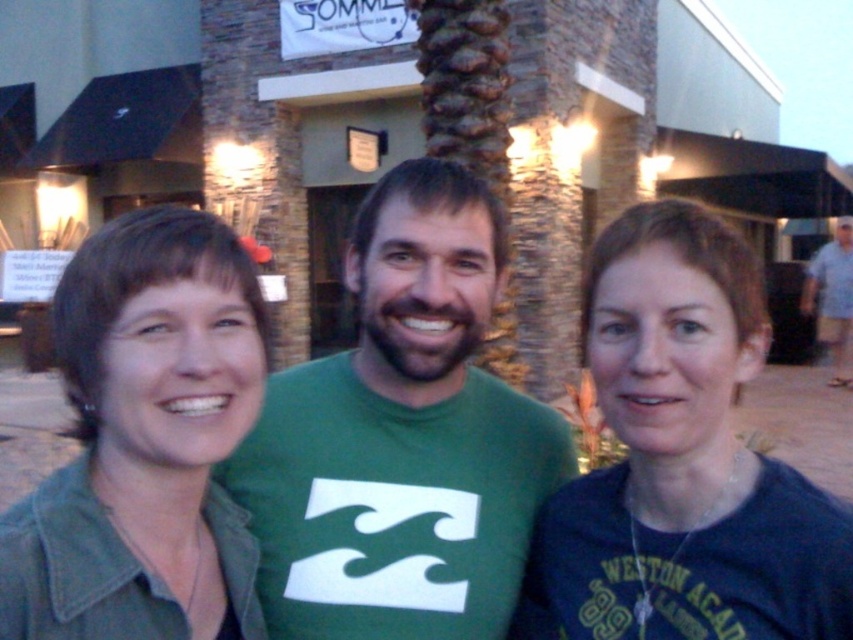
Question: Is denim jacket at left bigger than light blue shirt at right?

Choices:
 (A) no
 (B) yes

Answer: (B)

Question: Among these objects, which one is farthest from the camera?

Choices:
 (A) light blue shirt at right
 (B) green matte t-shirt at center
 (C) dark blue t-shirt at center
 (D) denim jacket at left

Answer: (A)

Question: Does green matte t-shirt at center have a smaller size compared to denim jacket at left?

Choices:
 (A) yes
 (B) no

Answer: (B)

Question: Which object is the farthest from the green matte t-shirt at center?

Choices:
 (A) light blue shirt at right
 (B) dark blue t-shirt at center
 (C) denim jacket at left

Answer: (A)

Question: Which object is the farthest from the denim jacket at left?

Choices:
 (A) light blue shirt at right
 (B) green matte t-shirt at center

Answer: (A)

Question: Is green matte t-shirt at center above light blue shirt at right?

Choices:
 (A) no
 (B) yes

Answer: (A)